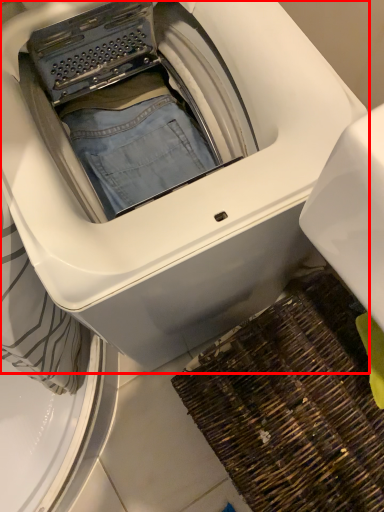
Question: From the image's perspective, what is the correct spatial positioning of washing machine (annotated by the red box) in reference to doormat?

Choices:
 (A) above
 (B) below

Answer: (A)